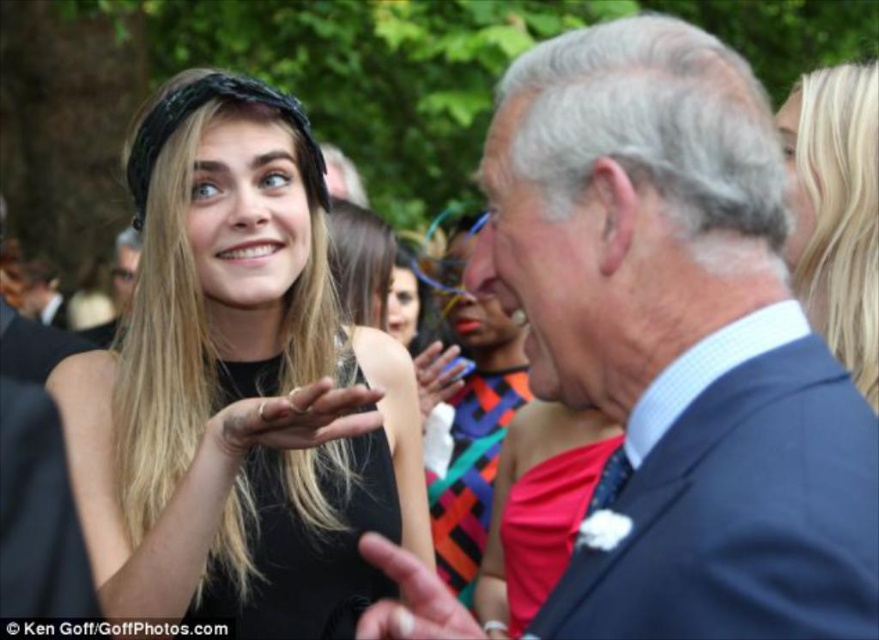
Which is above, multicolored fabric dress at center or matte black suit at center?

matte black suit at center

Locate an element on the screen. multicolored fabric dress at center is located at coordinates (469, 410).

Who is positioned more to the left, navy blue suit at center or blonde hair at upper right?

From the viewer's perspective, navy blue suit at center appears more on the left side.

Is the position of navy blue suit at center less distant than that of blonde hair at upper right?

Yes, it is in front of blonde hair at upper right.

Who is more forward, (843, 426) or (822, 164)?

Point (843, 426) is in front.

Image resolution: width=879 pixels, height=640 pixels. In order to click on navy blue suit at center in this screenshot , I will do `click(678, 340)`.

Who is higher up, black satin dress at left or multicolored fabric dress at center?

multicolored fabric dress at center is above.

Which is more to the left, black satin dress at left or multicolored fabric dress at center?

black satin dress at left is more to the left.

Measure the distance between point (204, 513) and camera.

Point (204, 513) and camera are 2.87 meters apart.

The height and width of the screenshot is (640, 879). I want to click on black satin dress at left, so click(238, 385).